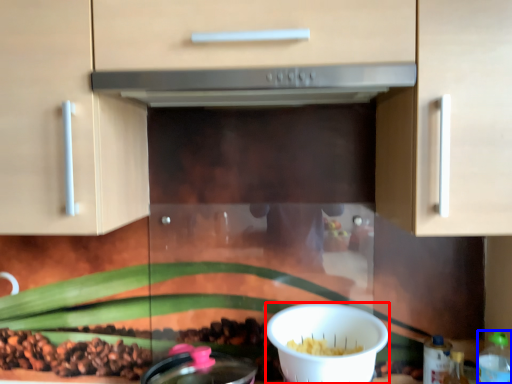
Question: Which point is closer to the camera, bowl (highlighted by a red box) or bottle (highlighted by a blue box)?

Choices:
 (A) bowl
 (B) bottle

Answer: (B)